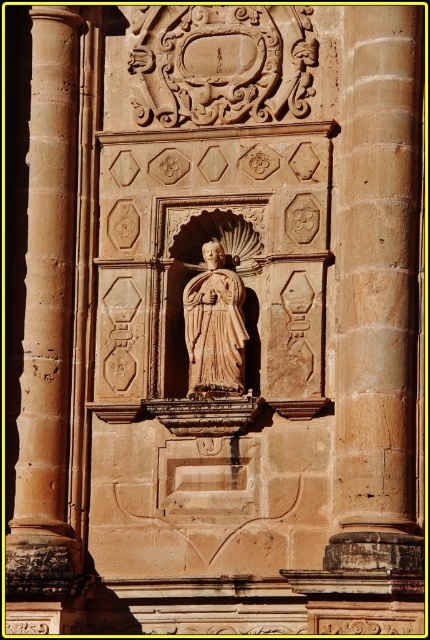
Question: Does smooth stone pillar at center appear over beige stone statue at center?

Choices:
 (A) no
 (B) yes

Answer: (B)

Question: Which of the following is the farthest from the observer?

Choices:
 (A) (211, 376)
 (B) (362, 184)

Answer: (A)

Question: Where is smooth stone pillar at center located in relation to beige stone statue at center in the image?

Choices:
 (A) left
 (B) right

Answer: (B)

Question: Does smooth stone pillar at center have a greater width compared to beige stone statue at center?

Choices:
 (A) no
 (B) yes

Answer: (B)

Question: Among these points, which one is nearest to the camera?

Choices:
 (A) (199, 353)
 (B) (349, 262)

Answer: (B)

Question: Among these objects, which one is nearest to the camera?

Choices:
 (A) smooth stone pillar at center
 (B) beige stone statue at center

Answer: (A)